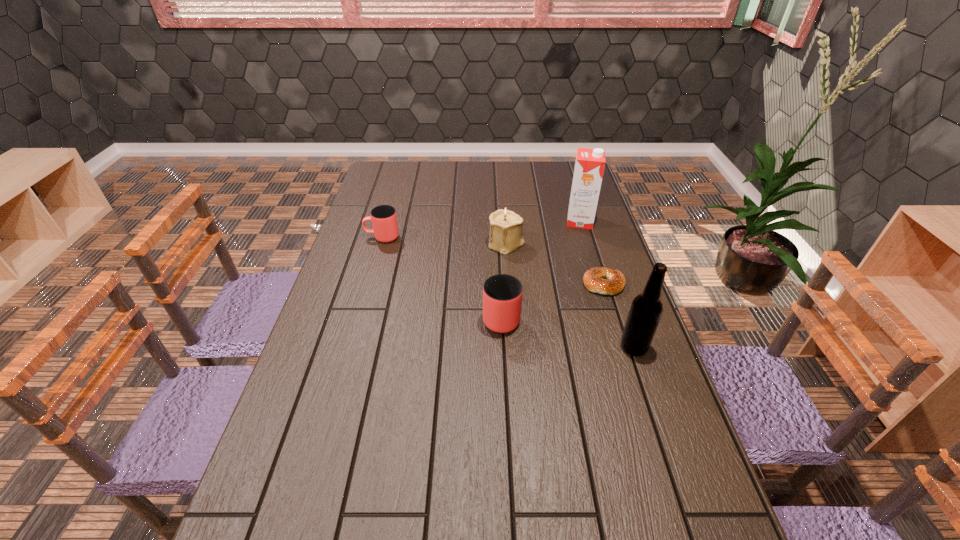
I want to click on the left cup, so click(384, 220).

Find the location of a particular element. the second shortest object is located at coordinates (384, 220).

This screenshot has height=540, width=960. Identify the location of the nearer cup. (502, 294).

The width and height of the screenshot is (960, 540). Identify the location of the fourth tallest object. (502, 294).

At what (x,y) coordinates should I click in order to perform the action: click on candle_holder. Please return your answer as a coordinate pair (x, y). The height and width of the screenshot is (540, 960). Looking at the image, I should click on (506, 227).

Image resolution: width=960 pixels, height=540 pixels. In order to click on carton in this screenshot , I will do `click(589, 166)`.

Locate an element on the screen. Image resolution: width=960 pixels, height=540 pixels. beer bottle is located at coordinates (646, 309).

The image size is (960, 540). I want to click on the shortest object, so click(593, 280).

At what (x,y) coordinates should I click in order to perform the action: click on bagel. Please return your answer as a coordinate pair (x, y). The width and height of the screenshot is (960, 540). Looking at the image, I should click on (593, 280).

This screenshot has width=960, height=540. I want to click on vacant space located 0.150m on the handle side of the second nearest object, so click(x=498, y=266).